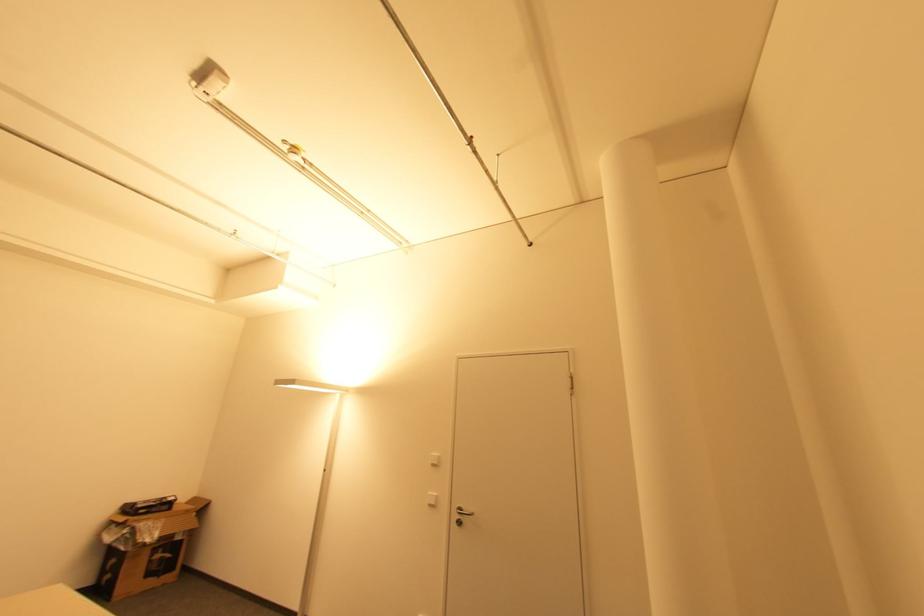
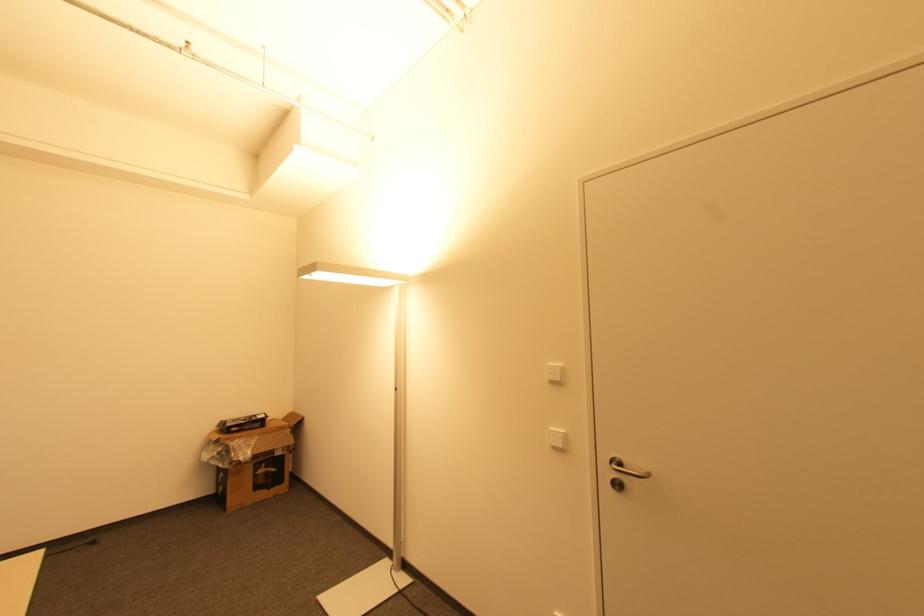
The point at (433, 506) is marked in the first image. Where is the corresponding point in the second image?

(557, 448)